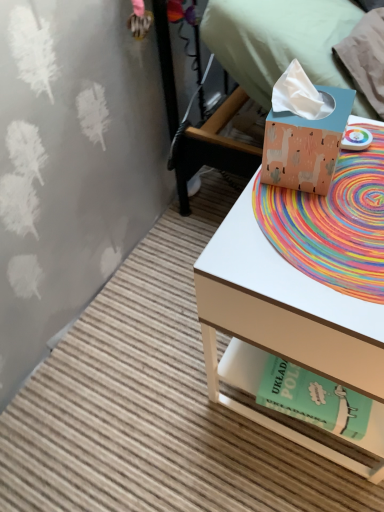
Question: In the image, is matte peach tissue box at upper right on the left side or the right side of green paper at lower right?

Choices:
 (A) left
 (B) right

Answer: (A)

Question: Does point (312, 125) appear closer or farther from the camera than point (268, 380)?

Choices:
 (A) farther
 (B) closer

Answer: (B)

Question: Which object is positioned closest to the matte cardboard tissue box at right?

Choices:
 (A) rainbow woven mat at center
 (B) matte blue tissue box at upper right
 (C) matte peach tissue box at upper right
 (D) green paper at lower right

Answer: (A)

Question: Which object is the farthest from the green paper at lower right?

Choices:
 (A) matte blue tissue box at upper right
 (B) rainbow woven mat at center
 (C) matte peach tissue box at upper right
 (D) matte cardboard tissue box at right

Answer: (A)